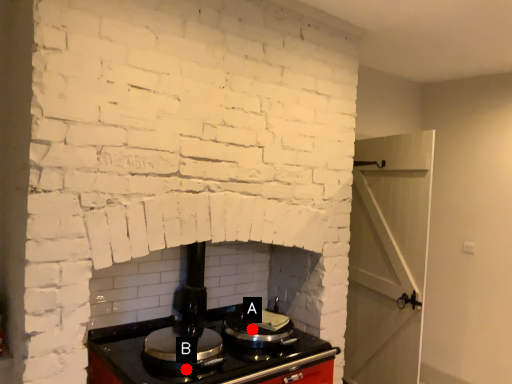
Question: Two points are circled on the image, labeled by A and B beside each circle. Which point is closer to the camera?

Choices:
 (A) A is closer
 (B) B is closer

Answer: (B)